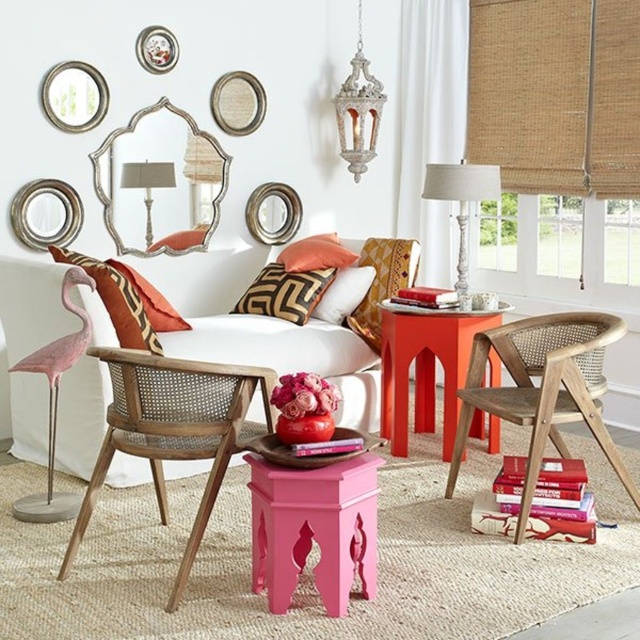
Question: Is white fabric couch at center above matte orange side table at center?

Choices:
 (A) no
 (B) yes

Answer: (A)

Question: Which point is farther to the camera?

Choices:
 (A) matte pink wood side table at center
 (B) goldgeometric patternpillow at center

Answer: (B)

Question: Which point is farther to the camera?

Choices:
 (A) (476, 17)
 (B) (358, 88)
 (C) (449, 336)

Answer: (B)

Question: Is matte pink wood side table at center above white fabric lampshade at upper center?

Choices:
 (A) yes
 (B) no

Answer: (B)

Question: Does gold textured pillow at center have a greater width compared to white fabric lampshade at upper center?

Choices:
 (A) yes
 (B) no

Answer: (A)

Question: Which is farther from the matte orange side table at center?

Choices:
 (A) matte gold pillow at center
 (B) wooden cane armchair at center
 (C) goldgeometric patternpillow at center

Answer: (B)